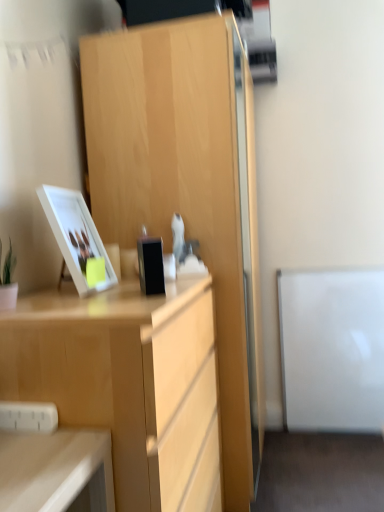
Question: Could you tell me if light wood desk at center is turned towards light wood cabinet at center?

Choices:
 (A) no
 (B) yes

Answer: (A)

Question: Is light wood desk at center positioned behind light wood cabinet at center?

Choices:
 (A) yes
 (B) no

Answer: (B)

Question: From the image's perspective, is light wood desk at center under light wood cabinet at center?

Choices:
 (A) yes
 (B) no

Answer: (A)

Question: Does light wood desk at center appear on the left side of light wood cabinet at center?

Choices:
 (A) yes
 (B) no

Answer: (A)

Question: Can you confirm if light wood desk at center is thinner than light wood cabinet at center?

Choices:
 (A) yes
 (B) no

Answer: (A)

Question: Is black glossy phone at center wider or thinner than light wood cabinet at center?

Choices:
 (A) thin
 (B) wide

Answer: (A)

Question: Looking at the image, does black glossy phone at center seem bigger or smaller compared to light wood cabinet at center?

Choices:
 (A) big
 (B) small

Answer: (B)

Question: From the image's perspective, is black glossy phone at center located above or below light wood cabinet at center?

Choices:
 (A) above
 (B) below

Answer: (A)

Question: From a real-world perspective, relative to light wood cabinet at center, is black glossy phone at center vertically above or below?

Choices:
 (A) above
 (B) below

Answer: (A)

Question: Does point (56, 225) appear closer or farther from the camera than point (114, 165)?

Choices:
 (A) closer
 (B) farther

Answer: (A)

Question: Is white glossy picture frame at upper left wider or thinner than light wood cabinet at center?

Choices:
 (A) thin
 (B) wide

Answer: (A)

Question: In the image, is white glossy picture frame at upper left positioned in front of or behind light wood cabinet at center?

Choices:
 (A) front
 (B) behind

Answer: (A)

Question: From their relative heights in the image, would you say white glossy picture frame at upper left is taller or shorter than light wood cabinet at center?

Choices:
 (A) tall
 (B) short

Answer: (B)

Question: In the image, is white glossy picture frame at upper left on the left side or the right side of black glossy phone at center?

Choices:
 (A) right
 (B) left

Answer: (B)

Question: In terms of width, does white glossy picture frame at upper left look wider or thinner when compared to black glossy phone at center?

Choices:
 (A) wide
 (B) thin

Answer: (A)